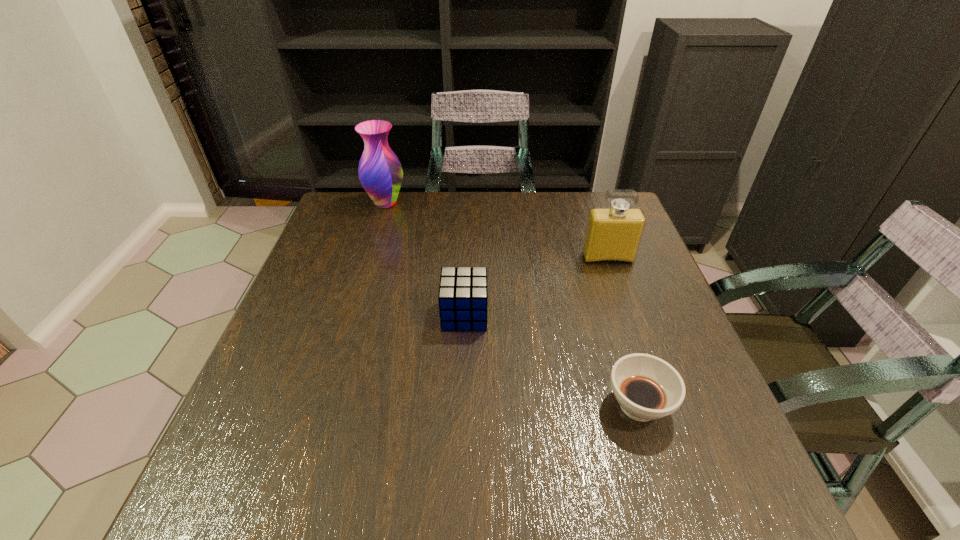
Locate an element on the screen. vase is located at coordinates (380, 172).

Identify the location of the leftmost object. The width and height of the screenshot is (960, 540). (380, 172).

This screenshot has height=540, width=960. In order to click on perfume in this screenshot , I will do `click(613, 234)`.

Where is `the second tallest object`? The image size is (960, 540). the second tallest object is located at coordinates (613, 234).

I want to click on the second object from left to right, so click(463, 295).

Identify the location of cube. (463, 295).

Where is `the nearest object`? The width and height of the screenshot is (960, 540). the nearest object is located at coordinates (647, 388).

Identify the location of soup bowl. This screenshot has width=960, height=540. (647, 388).

Identify the location of vacant area located on the right of the farthest object. This screenshot has width=960, height=540. (512, 203).

Locate an element on the screen. The width and height of the screenshot is (960, 540). vacant space located on the front-facing side of the second tallest object is located at coordinates (649, 376).